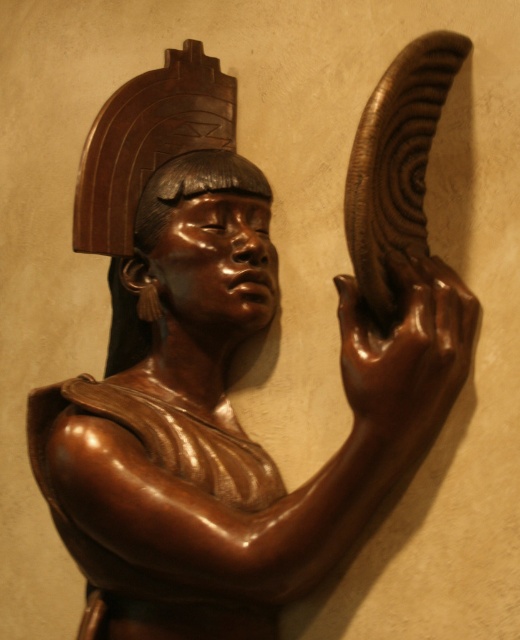
Question: Which of the following is the farthest from the observer?

Choices:
 (A) shiny brown hand at upper right
 (B) matte brown head at center

Answer: (B)

Question: Which point is farther from the camera taking this photo?

Choices:
 (A) (188, 156)
 (B) (417, 362)

Answer: (A)

Question: Can you confirm if shiny brown hand at upper right is smaller than matte brown head at center?

Choices:
 (A) no
 (B) yes

Answer: (B)

Question: Does shiny brown hand at upper right have a lesser width compared to matte brown head at center?

Choices:
 (A) no
 (B) yes

Answer: (B)

Question: Where is shiny brown hand at upper right located in relation to matte brown head at center in the image?

Choices:
 (A) above
 (B) below

Answer: (B)